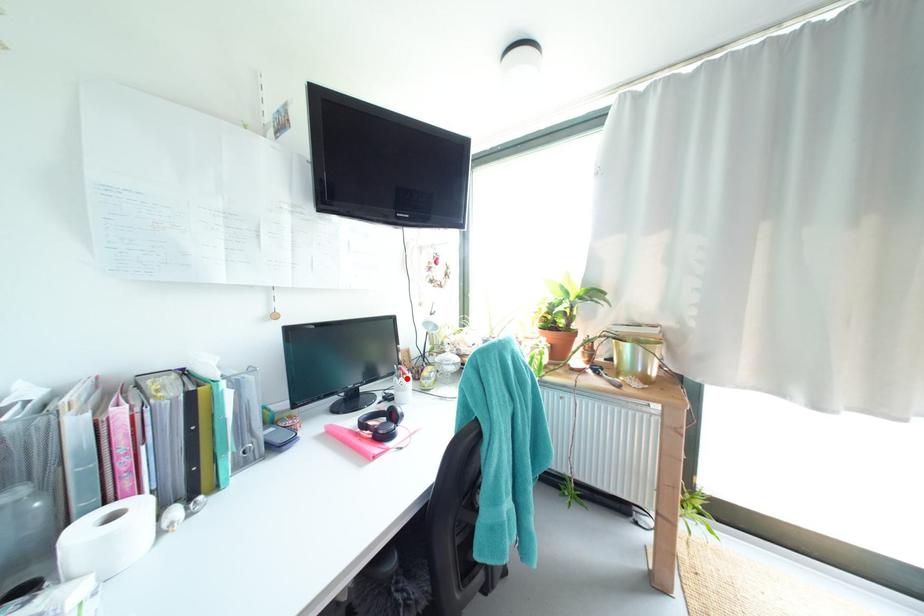
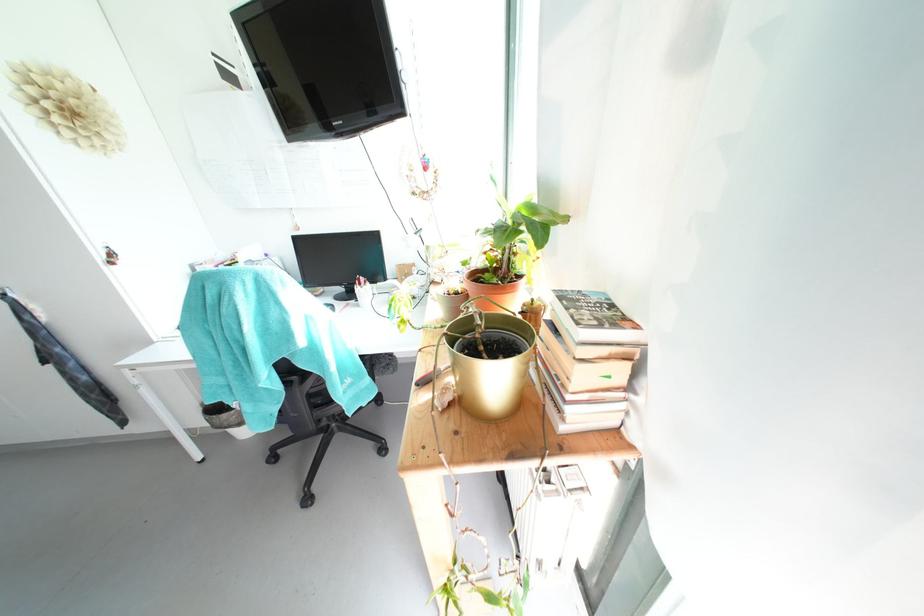
Find the pixel in the second image that matches the highlighted location in the first image.

(362, 286)